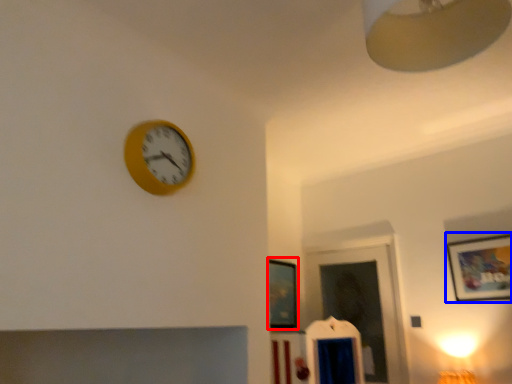
Question: Which point is closer to the camera, picture frame (highlighted by a red box) or picture frame (highlighted by a blue box)?

Choices:
 (A) picture frame
 (B) picture frame

Answer: (B)